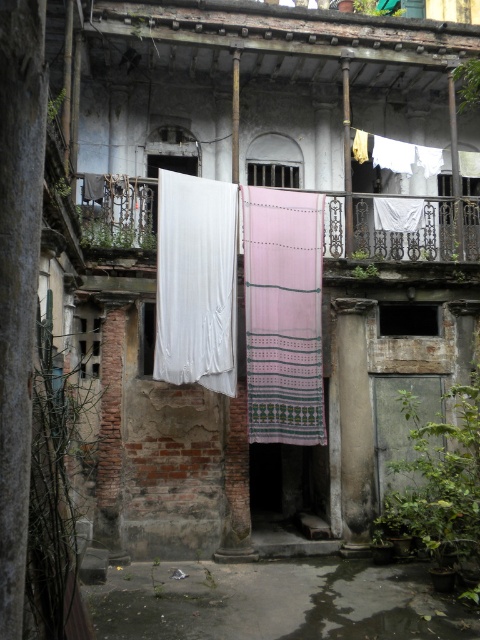
Question: Can you confirm if pink woven cloth at center is positioned to the left of white fabric curtain at left?

Choices:
 (A) yes
 (B) no

Answer: (B)

Question: Is concrete floor at lower center below pink woven cloth at center?

Choices:
 (A) no
 (B) yes

Answer: (B)

Question: Which object is the farthest from the concrete floor at lower center?

Choices:
 (A) white fabric at upper center
 (B) pink woven cloth at center
 (C) white fabric curtain at left

Answer: (A)

Question: Which point appears farthest from the camera in this image?

Choices:
 (A) (310, 330)
 (B) (387, 596)
 (C) (172, 364)

Answer: (A)

Question: Considering the real-world distances, which object is farthest from the pink woven cloth at center?

Choices:
 (A) concrete floor at lower center
 (B) white fabric curtain at left

Answer: (A)

Question: Can you confirm if white fabric curtain at left is bigger than white fabric at upper center?

Choices:
 (A) yes
 (B) no

Answer: (A)